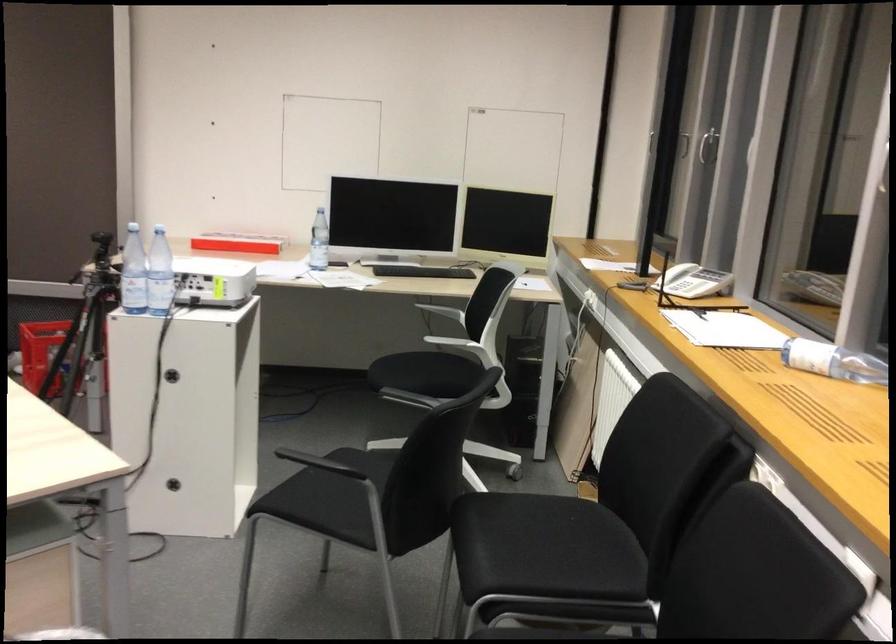
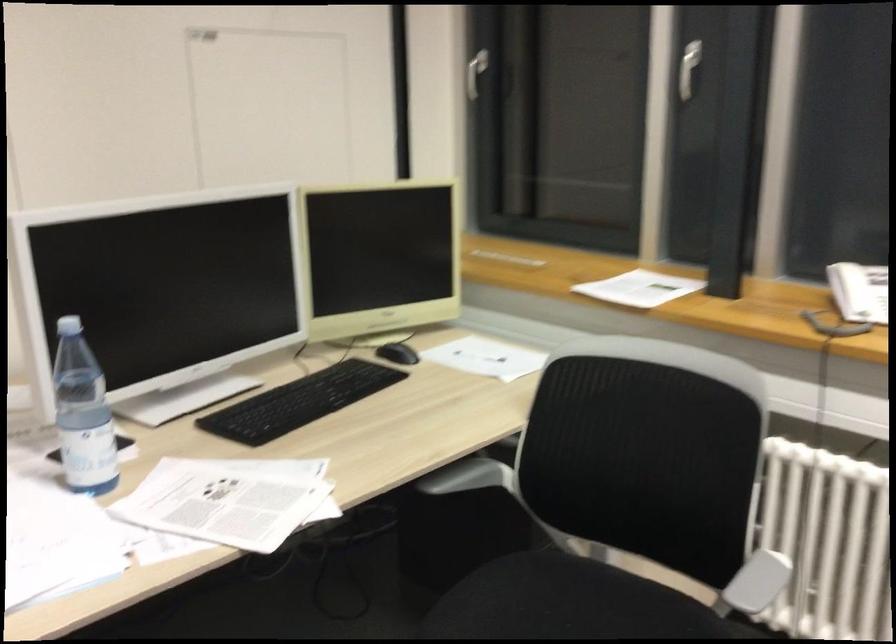
Locate, in the second image, the point that corresponds to pixel 702 133 in the first image.

(688, 69)